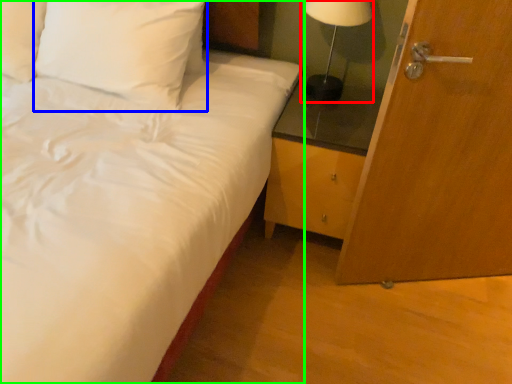
Question: Which object is the closest to the table lamp (highlighted by a red box)? Choose among these: pillow (highlighted by a blue box) or bed (highlighted by a green box).

Choices:
 (A) pillow
 (B) bed

Answer: (A)